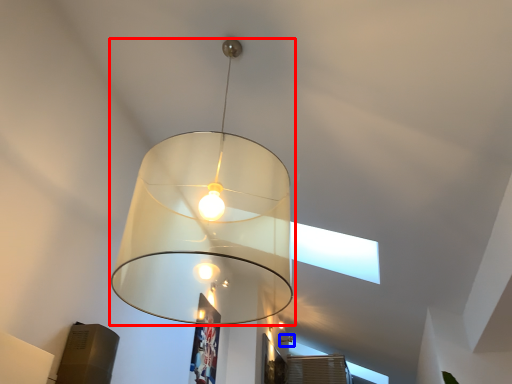
Question: Which object is closer to the camera taking this photo, lamp (highlighted by a red box) or lamp (highlighted by a blue box)?

Choices:
 (A) lamp
 (B) lamp

Answer: (A)